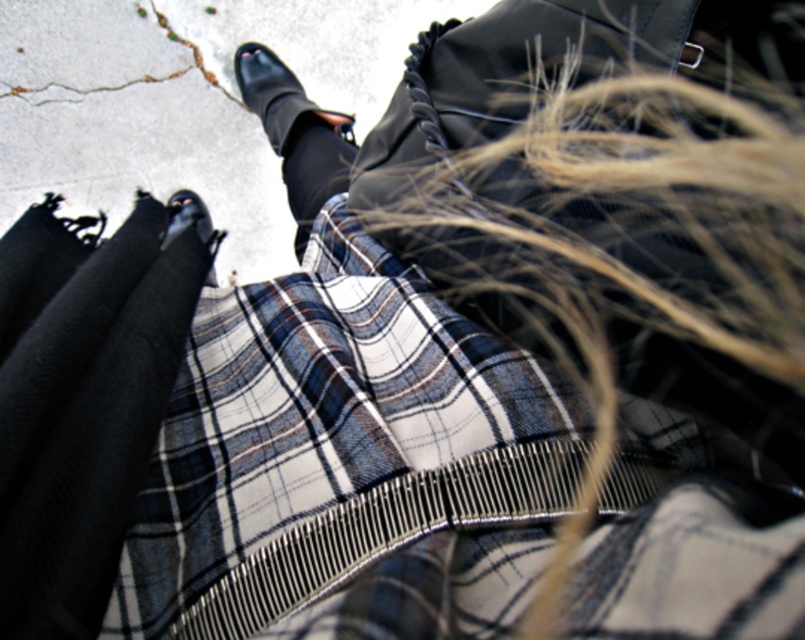
Question: Does plaid fabric at center appear under black leather shoe at center?

Choices:
 (A) no
 (B) yes

Answer: (B)

Question: Where is plaid fabric at center located in relation to black leather shoe at center in the image?

Choices:
 (A) left
 (B) right

Answer: (B)

Question: Which object is positioned closest to the black leather shoe at center?

Choices:
 (A) black smooth sock at center
 (B) black leather shoe at lower left
 (C) black woolen tights at lower left
 (D) black leather boot at upper center

Answer: (D)

Question: Which point is farther to the camera?

Choices:
 (A) black leather shoe at center
 (B) plaid fabric at center

Answer: (A)

Question: Can you confirm if black leather boot at upper center is positioned to the right of black leather shoe at center?

Choices:
 (A) yes
 (B) no

Answer: (A)

Question: Which point is farther from the camera taking this photo?

Choices:
 (A) (366, 268)
 (B) (43, 278)
 (C) (259, 108)

Answer: (C)